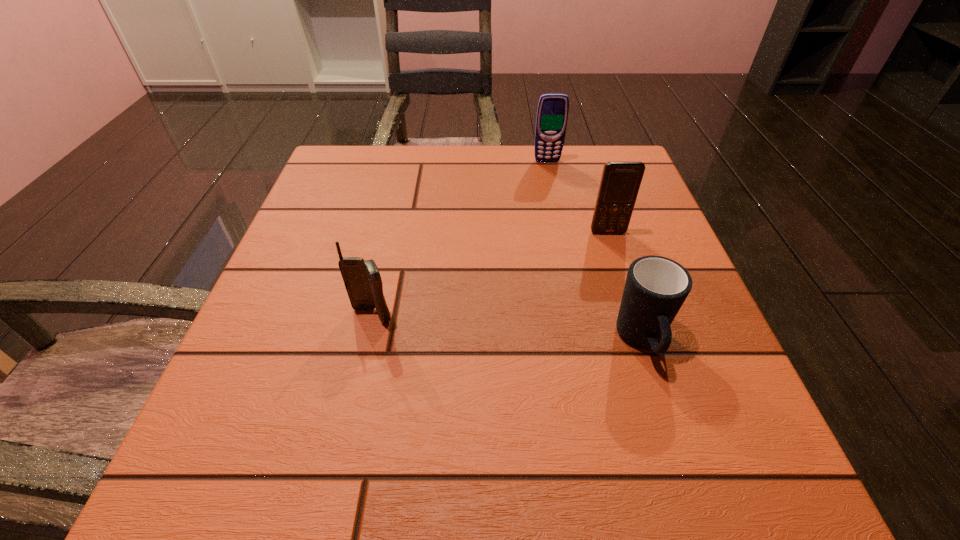
The height and width of the screenshot is (540, 960). Identify the location of free space between the mug and the second object from left to right. (594, 252).

Identify the location of unoccupied position between the farthest object and the second farthest object. The image size is (960, 540). (577, 197).

This screenshot has height=540, width=960. Identify the location of free area in between the farthest cellular telephone and the mug. (594, 252).

Locate which object ranks third in proximity to the mug. Please provide its 2D coordinates. Your answer should be formatted as a tuple, i.e. [(x, y)], where the tuple contains the x and y coordinates of a point satisfying the conditions above.

[(552, 112)]

Identify which object is the second nearest to the leftmost cellular telephone. Please provide its 2D coordinates. Your answer should be formatted as a tuple, i.e. [(x, y)], where the tuple contains the x and y coordinates of a point satisfying the conditions above.

[(620, 182)]

Locate which cellular telephone is the closest to the nearest cellular telephone. Please provide its 2D coordinates. Your answer should be formatted as a tuple, i.e. [(x, y)], where the tuple contains the x and y coordinates of a point satisfying the conditions above.

[(620, 182)]

Find the location of a particular element. cellular telephone that stands as the closest to the farthest cellular telephone is located at coordinates (620, 182).